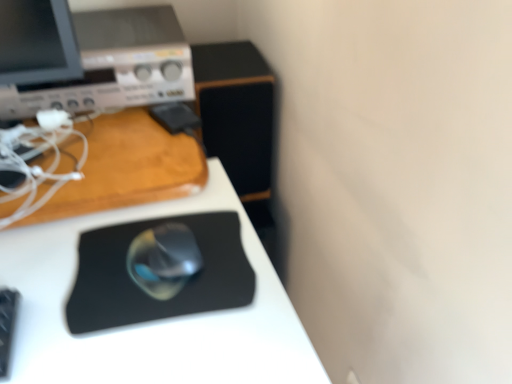
The image size is (512, 384). In order to click on empty space that is to the right of satin silver mouse at center in this screenshot , I will do `click(240, 276)`.